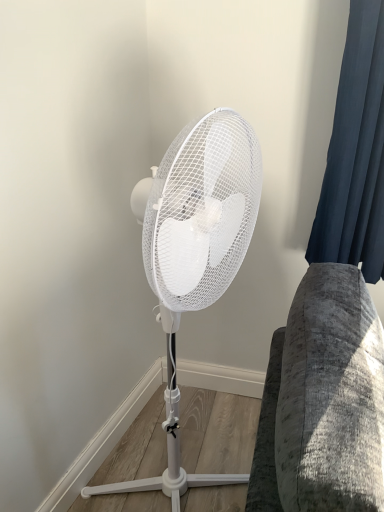
Question: From the image's perspective, is dark blue fabric at right located above white matte mechanical fan at center?

Choices:
 (A) no
 (B) yes

Answer: (B)

Question: From the image's perspective, does dark blue fabric at right appear lower than white matte mechanical fan at center?

Choices:
 (A) no
 (B) yes

Answer: (A)

Question: Is dark blue fabric at right facing away from white matte mechanical fan at center?

Choices:
 (A) no
 (B) yes

Answer: (A)

Question: Can you confirm if dark blue fabric at right is positioned to the right of white matte mechanical fan at center?

Choices:
 (A) yes
 (B) no

Answer: (A)

Question: Is dark blue fabric at right bigger than white matte mechanical fan at center?

Choices:
 (A) no
 (B) yes

Answer: (A)

Question: Is dark blue fabric at right outside white matte mechanical fan at center?

Choices:
 (A) no
 (B) yes

Answer: (B)

Question: Can we say white matte mechanical fan at center lies outside dark blue fabric at right?

Choices:
 (A) yes
 (B) no

Answer: (A)

Question: Can you confirm if white matte mechanical fan at center is positioned to the left of dark blue fabric at right?

Choices:
 (A) yes
 (B) no

Answer: (A)

Question: Is white matte mechanical fan at center looking in the opposite direction of dark blue fabric at right?

Choices:
 (A) yes
 (B) no

Answer: (B)

Question: Can you confirm if white matte mechanical fan at center is positioned to the right of dark blue fabric at right?

Choices:
 (A) no
 (B) yes

Answer: (A)

Question: Would you say white matte mechanical fan at center is a long distance from dark blue fabric at right?

Choices:
 (A) no
 (B) yes

Answer: (A)

Question: Considering the relative sizes of white matte mechanical fan at center and dark blue fabric at right in the image provided, is white matte mechanical fan at center smaller than dark blue fabric at right?

Choices:
 (A) yes
 (B) no

Answer: (B)

Question: From a real-world perspective, is dark blue fabric at right physically located above or below white matte mechanical fan at center?

Choices:
 (A) below
 (B) above

Answer: (B)